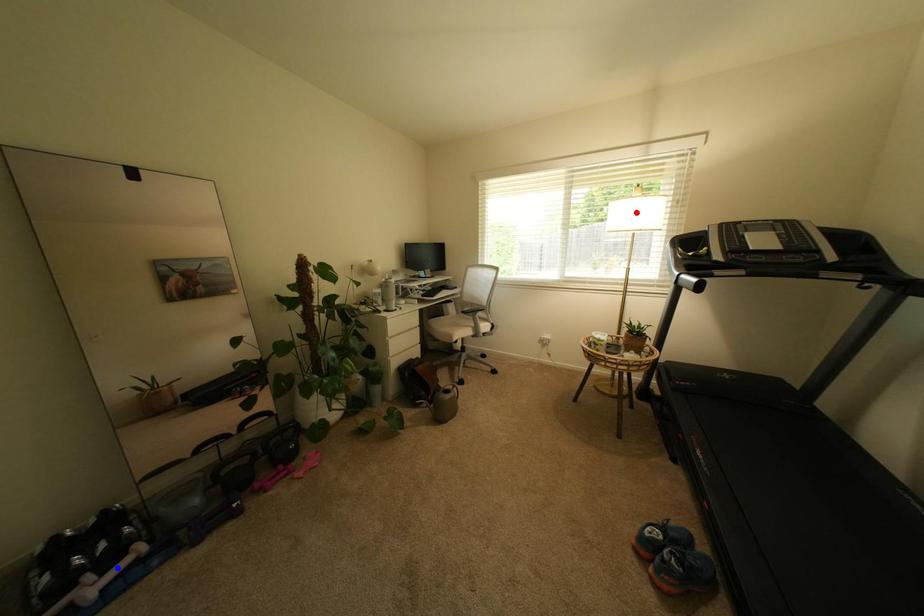
Question: Two points are marked on the image. Which point is closer to the camera?

Choices:
 (A) Blue point is closer.
 (B) Red point is closer.

Answer: (A)